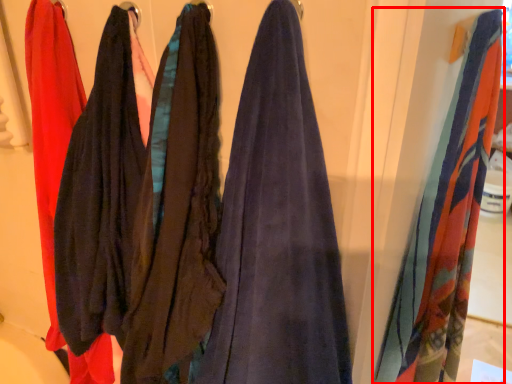
Question: Where is towel (annotated by the red box) located in relation to clothing in the image?

Choices:
 (A) left
 (B) right

Answer: (B)